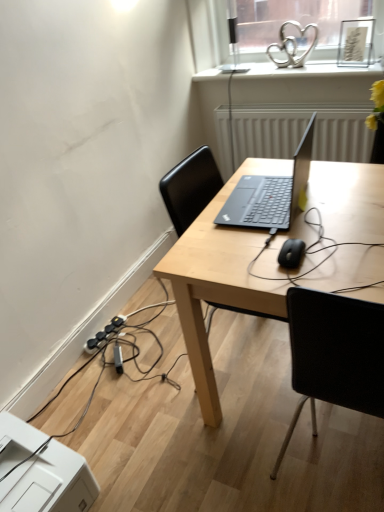
Question: From the image's perspective, does white glossy heart-shaped object at upper center appear lower than black matte mouse at center?

Choices:
 (A) yes
 (B) no

Answer: (B)

Question: Is white glossy heart-shaped object at upper center shorter than black matte mouse at center?

Choices:
 (A) no
 (B) yes

Answer: (A)

Question: Does white glossy heart-shaped object at upper center lie behind black matte mouse at center?

Choices:
 (A) no
 (B) yes

Answer: (B)

Question: Does white glossy heart-shaped object at upper center have a smaller size compared to black matte mouse at center?

Choices:
 (A) no
 (B) yes

Answer: (A)

Question: Is white glossy heart-shaped object at upper center thinner than black matte mouse at center?

Choices:
 (A) yes
 (B) no

Answer: (B)

Question: Is white glossy heart-shaped object at upper center positioned before black matte mouse at center?

Choices:
 (A) no
 (B) yes

Answer: (A)

Question: Could you tell me if black plastic extension cord at lower left is turned towards white plastic printer at lower left?

Choices:
 (A) yes
 (B) no

Answer: (B)

Question: Considering the relative positions of black plastic extension cord at lower left and white plastic printer at lower left in the image provided, is black plastic extension cord at lower left to the right of white plastic printer at lower left from the viewer's perspective?

Choices:
 (A) no
 (B) yes

Answer: (B)

Question: Can you confirm if black plastic extension cord at lower left is positioned to the left of white plastic printer at lower left?

Choices:
 (A) no
 (B) yes

Answer: (A)

Question: Is black plastic extension cord at lower left smaller than white plastic printer at lower left?

Choices:
 (A) no
 (B) yes

Answer: (B)

Question: Can you confirm if black plastic extension cord at lower left is thinner than white plastic printer at lower left?

Choices:
 (A) yes
 (B) no

Answer: (A)

Question: Is black plastic extension cord at lower left oriented away from white plastic printer at lower left?

Choices:
 (A) no
 (B) yes

Answer: (A)

Question: From the image's perspective, is light wood desk at center under white textured radiator at center?

Choices:
 (A) yes
 (B) no

Answer: (A)